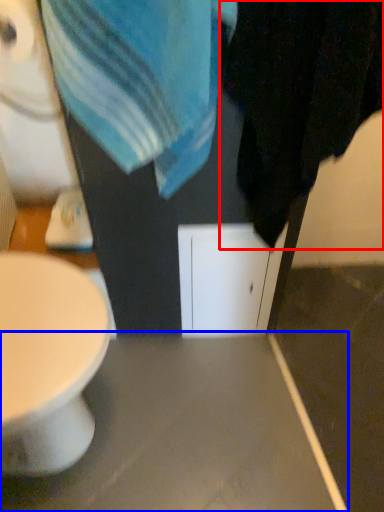
Question: Among these objects, which one is farthest to the camera, bath towel (highlighted by a red box) or table (highlighted by a blue box)?

Choices:
 (A) bath towel
 (B) table

Answer: (B)